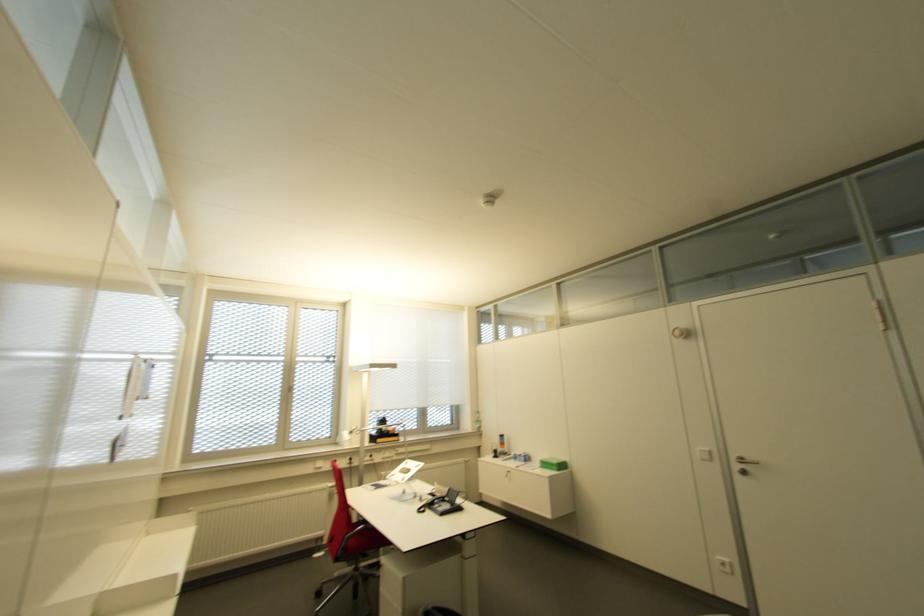
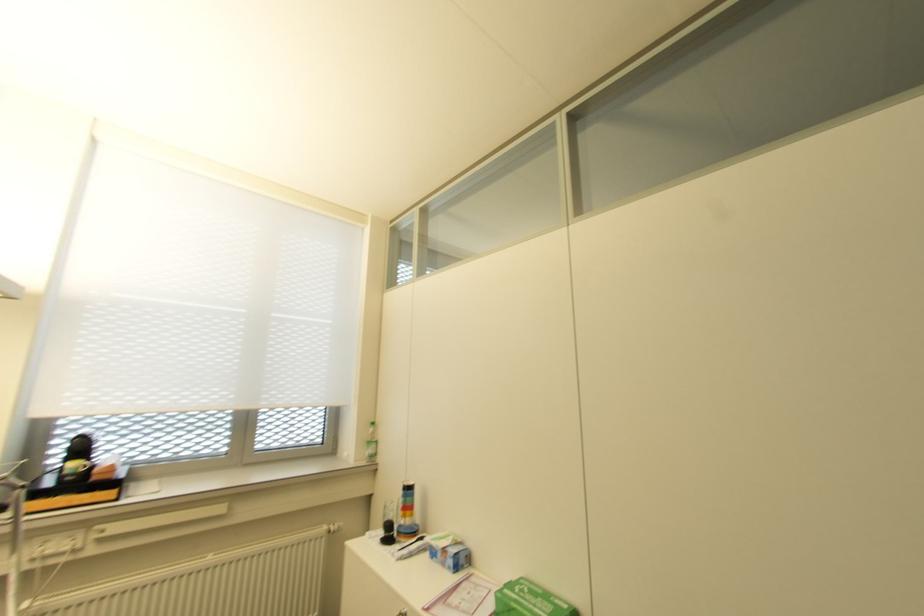
Find the pixel in the second image that matches the point at 524,461 in the first image.

(454, 568)